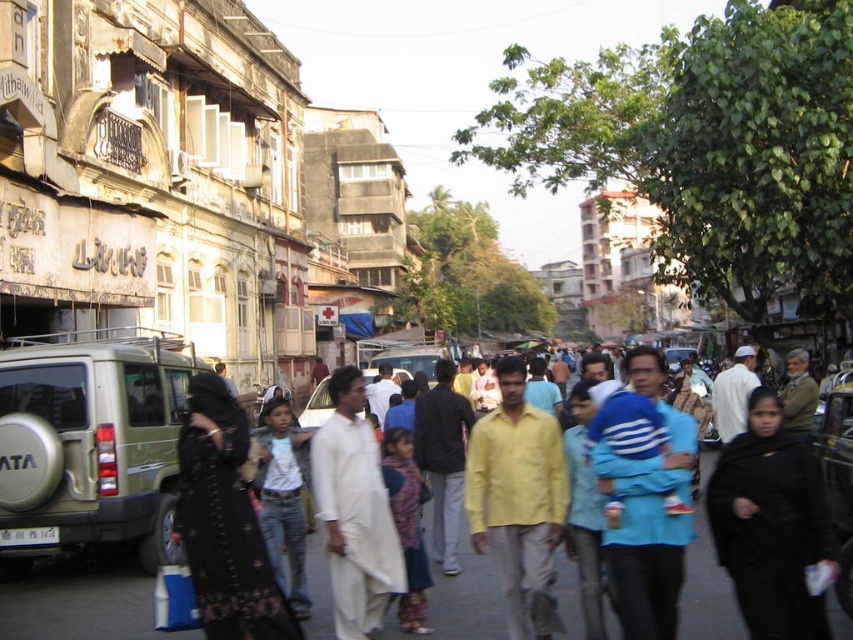
Who is positioned more to the left, black fabric at center or matte white shirt at center?

matte white shirt at center

Does black fabric at center appear under matte white shirt at center?

No.

The width and height of the screenshot is (853, 640). I want to click on black fabric at center, so click(x=770, y=524).

Where is `black fabric at center`? This screenshot has height=640, width=853. black fabric at center is located at coordinates (770, 524).

Can you confirm if matte gold suv at left is thinner than black textured dress at center?

No.

Is matte gold suv at left further to camera compared to black textured dress at center?

That is True.

Is point (22, 362) positioned in front of point (204, 538)?

That is False.

This screenshot has width=853, height=640. Find the location of `matte gold suv at left`. matte gold suv at left is located at coordinates (90, 444).

Who is more forward, (750, 417) or (352, 458)?

Positioned in front is point (750, 417).

Is point (788, 544) positioned after point (337, 577)?

No, it is in front of (337, 577).

The width and height of the screenshot is (853, 640). What are the coordinates of `black fabric at center` in the screenshot? It's located at [x=770, y=524].